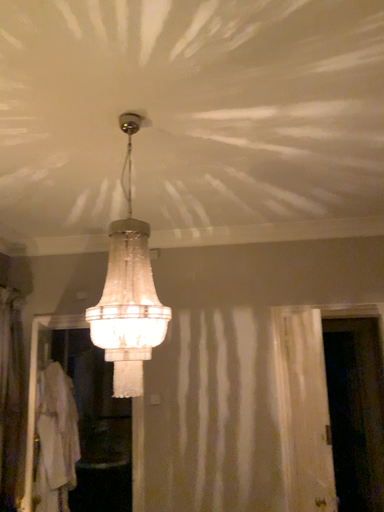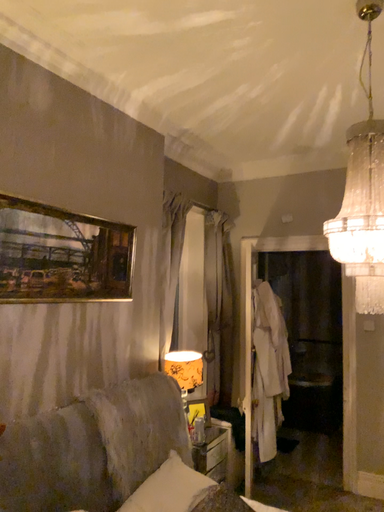
Question: Which way did the camera rotate in the video?

Choices:
 (A) rotated left
 (B) rotated right

Answer: (A)